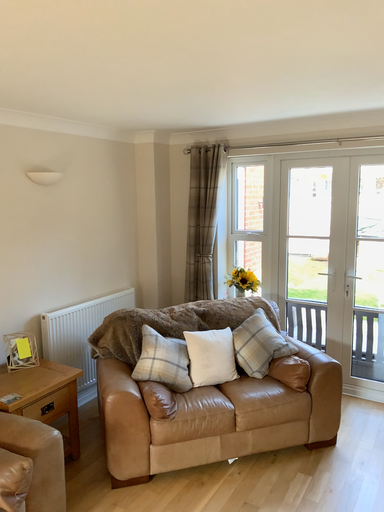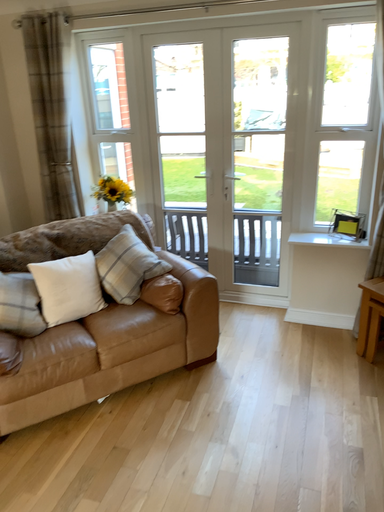
Question: How did the camera likely rotate when shooting the video?

Choices:
 (A) rotated downward
 (B) rotated upward

Answer: (A)